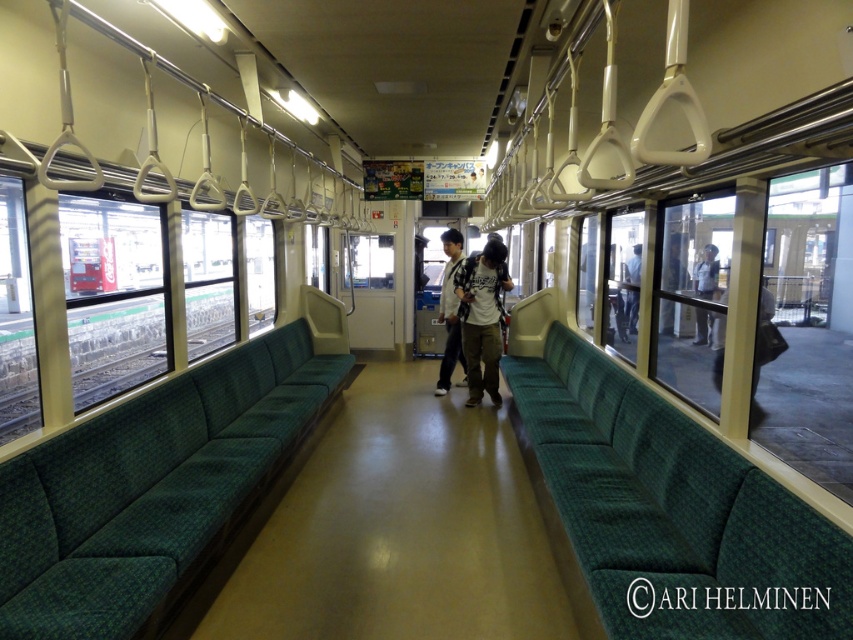
Question: Does green fabric couch at left appear on the right side of light gray uniform at center?

Choices:
 (A) yes
 (B) no

Answer: (B)

Question: Considering the real-world distances, which object is closest to the dark blue jeans at right?

Choices:
 (A) green fabric couch at center
 (B) green fabric couch at left

Answer: (A)

Question: Estimate the real-world distances between objects in this image. Which object is farther from the green fabric couch at center?

Choices:
 (A) dark blue jeans at right
 (B) light gray uniform at center

Answer: (B)

Question: Is green fabric couch at center positioned before dark blue jeans at right?

Choices:
 (A) yes
 (B) no

Answer: (A)

Question: Which object appears farthest from the camera in this image?

Choices:
 (A) light gray uniform at center
 (B) white cotton shirt at center

Answer: (A)

Question: Is green fabric couch at left bigger than white cotton shirt at center?

Choices:
 (A) yes
 (B) no

Answer: (A)